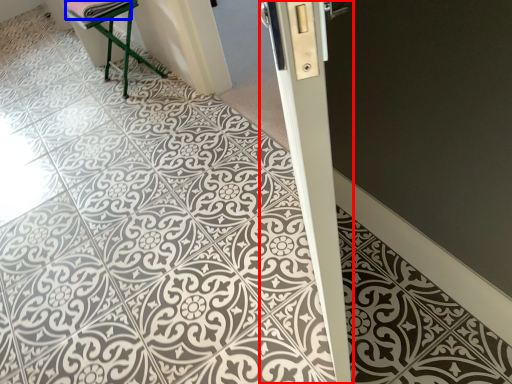
Question: Among these objects, which one is farthest to the camera, pillar (highlighted by a red box) or material (highlighted by a blue box)?

Choices:
 (A) pillar
 (B) material

Answer: (B)